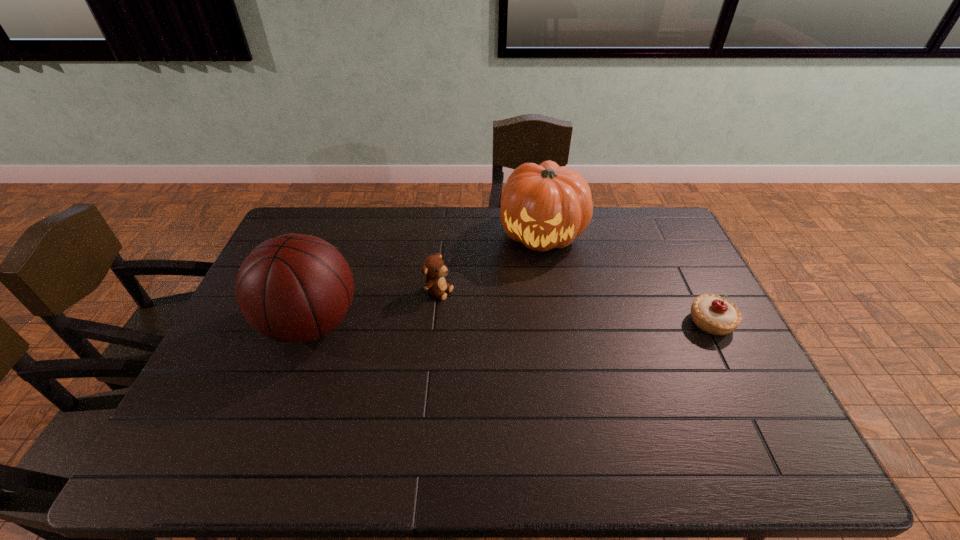
Locate an element on the screen. The width and height of the screenshot is (960, 540). vacant space on the desktop that is between the leftmost object and the shortest object and is positioned on the face of the third tallest object is located at coordinates (517, 323).

This screenshot has width=960, height=540. In order to click on vacant space on the desktop that is between the basketball and the rightmost object and is positioned on the carved face of the third object from left to right in this screenshot , I will do `click(535, 323)`.